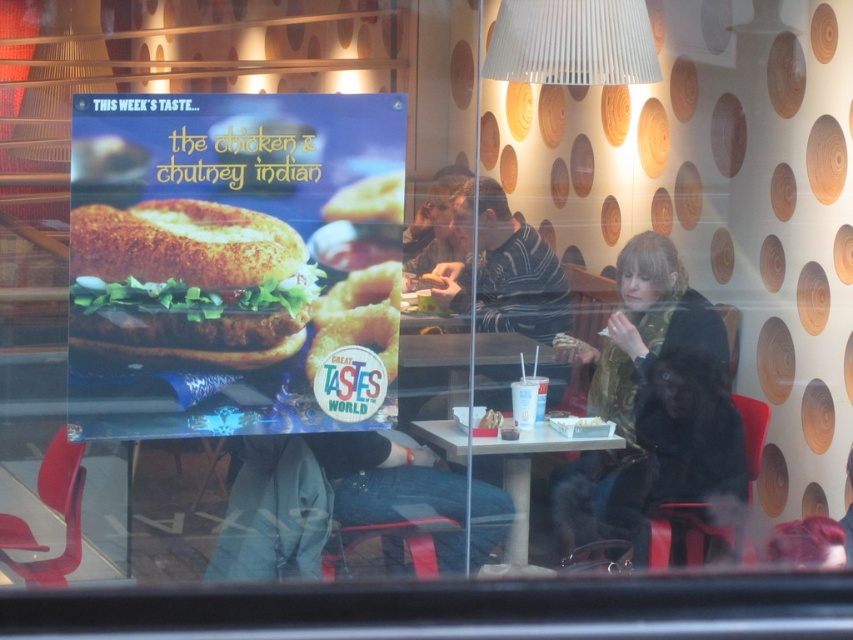
You are standing outside the restaurant looking through the window. There are two points marked on the window. One is at coordinate point (735, 417) and the other at point (459, 445). Which point is closer to you?

Point (459, 445) is closer to you because it is less further to the camera than point (735, 417).